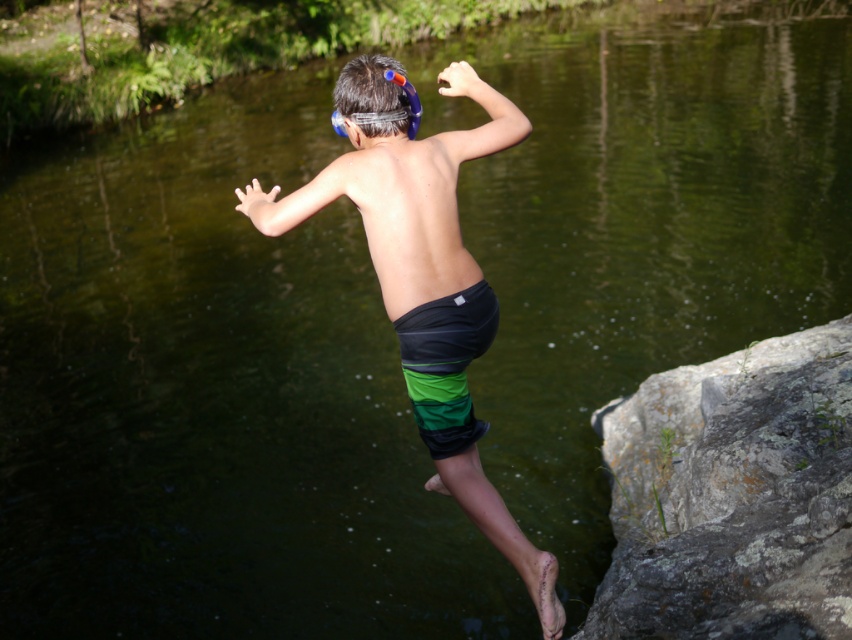
Does green striped shorts at center appear under blue rubber goggles at upper center?

Correct, green striped shorts at center is located below blue rubber goggles at upper center.

Does green striped shorts at center appear on the left side of blue rubber goggles at upper center?

Incorrect, green striped shorts at center is not on the left side of blue rubber goggles at upper center.

The height and width of the screenshot is (640, 852). Identify the location of green striped shorts at center. (412, 211).

Can you confirm if green striped shorts at center is positioned to the right of black/stretchy fabric shorts at center?

No, green striped shorts at center is not to the right of black/stretchy fabric shorts at center.

Find the location of `green striped shorts at center`. green striped shorts at center is located at coordinates (412, 211).

Which is behind, point (403, 284) or point (465, 432)?

Point (465, 432)

At what (x,y) coordinates should I click in order to perform the action: click on green striped shorts at center. Please return your answer as a coordinate pair (x, y). The height and width of the screenshot is (640, 852). Looking at the image, I should click on (412, 211).

Can you confirm if black/stretchy fabric shorts at center is positioned to the right of blue rubber goggles at upper center?

Yes, black/stretchy fabric shorts at center is to the right of blue rubber goggles at upper center.

Between black/stretchy fabric shorts at center and blue rubber goggles at upper center, which one appears on the left side from the viewer's perspective?

From the viewer's perspective, blue rubber goggles at upper center appears more on the left side.

Is point (450, 310) farther from viewer compared to point (416, 113)?

No, it is in front of (416, 113).

Locate an element on the screen. This screenshot has width=852, height=640. black/stretchy fabric shorts at center is located at coordinates (446, 364).